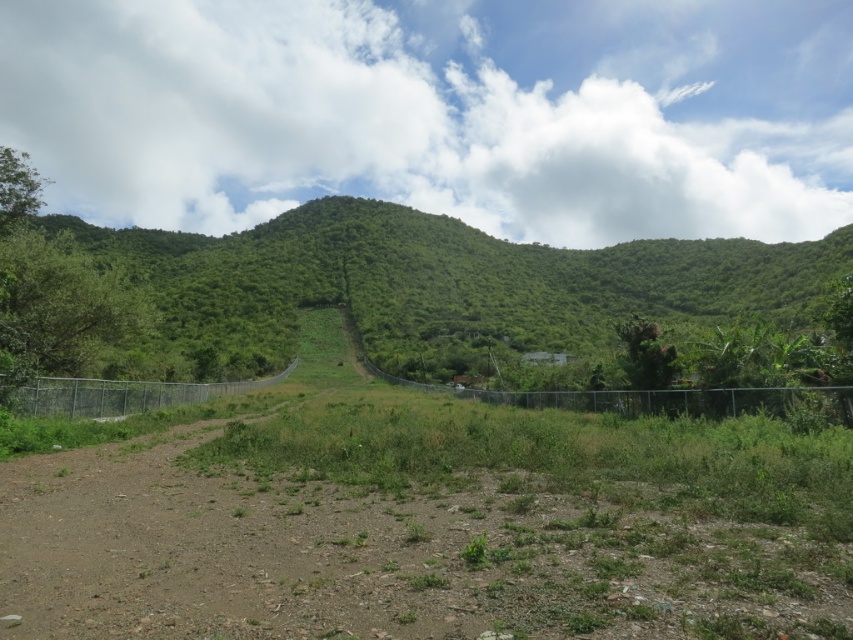
Between brown dirt track at center and metallic chain-link fence at center, which one is positioned higher?

brown dirt track at center

Consider the image. Does brown dirt track at center have a smaller size compared to metallic chain-link fence at center?

Indeed, brown dirt track at center has a smaller size compared to metallic chain-link fence at center.

Find the location of `brown dirt track at center`. brown dirt track at center is located at coordinates (432, 525).

Where is `brown dirt track at center`? brown dirt track at center is located at coordinates (432, 525).

Between point (767, 410) and point (19, 394), which one is positioned behind?

The point (767, 410) is behind.

Is point (751, 390) positioned after point (286, 372)?

No, (751, 390) is in front of (286, 372).

The image size is (853, 640). I want to click on metallic chain-link fence at center, so click(x=654, y=397).

Does brown dirt track at center lie in front of green leafy mountain at center?

That is True.

Which is in front, point (549, 497) or point (485, 241)?

Positioned in front is point (549, 497).

This screenshot has width=853, height=640. Describe the element at coordinates (432, 525) in the screenshot. I see `brown dirt track at center` at that location.

You are a GUI agent. You are given a task and a screenshot of the screen. Output one action in this format:
    pyautogui.click(x=<x>, y=<y>)
    Task: Click on the brown dirt track at center
    This screenshot has height=640, width=853.
    Given the screenshot: What is the action you would take?
    click(x=432, y=525)